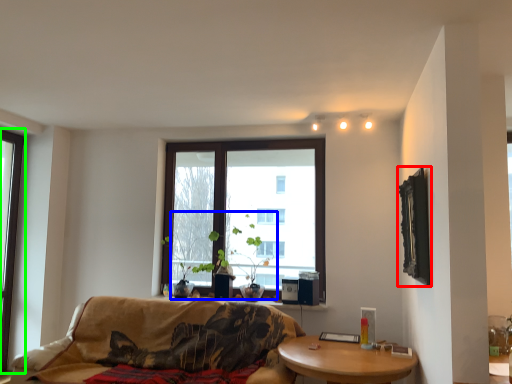
Question: Based on their relative distances, which object is farther from picture frame (highlighted by a red box)? Choose from plant (highlighted by a blue box) and window (highlighted by a green box).

Choices:
 (A) plant
 (B) window

Answer: (B)